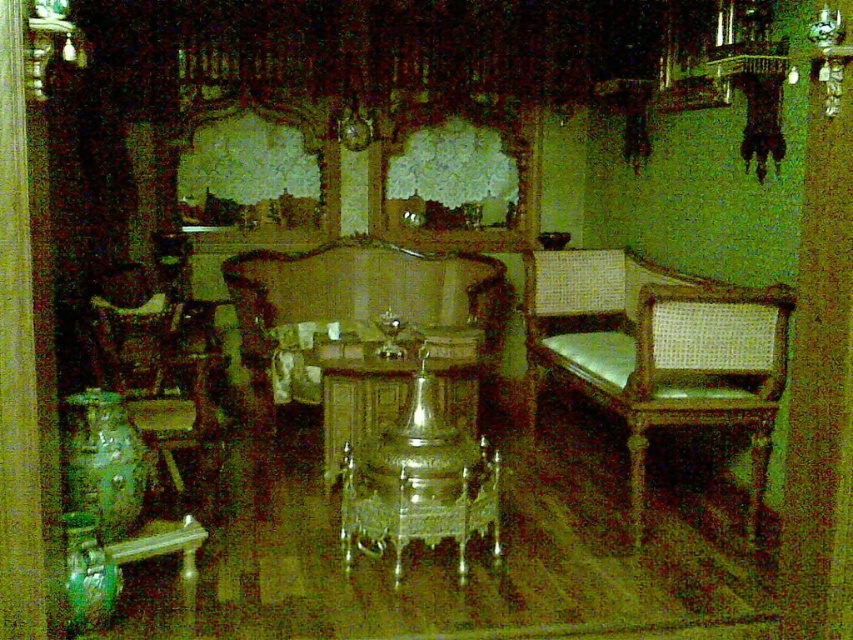
Question: Does wooden armchair at center appear over wooden armchair at left?

Choices:
 (A) yes
 (B) no

Answer: (A)

Question: Is woven wood armchair at right above wooden armchair at left?

Choices:
 (A) no
 (B) yes

Answer: (B)

Question: Which point is closer to the camera?

Choices:
 (A) woven wood armchair at right
 (B) wooden armchair at center
 (C) wooden polished table at center
 (D) wooden armchair at left

Answer: (A)

Question: Which object is farther from the camera taking this photo?

Choices:
 (A) woven wood armchair at right
 (B) wooden armchair at center

Answer: (B)

Question: Which of the following is the farthest from the observer?

Choices:
 (A) (654, 413)
 (B) (199, 304)
 (C) (410, 280)
 (D) (456, 384)

Answer: (C)

Question: Is woven wood armchair at right above wooden armchair at center?

Choices:
 (A) no
 (B) yes

Answer: (A)